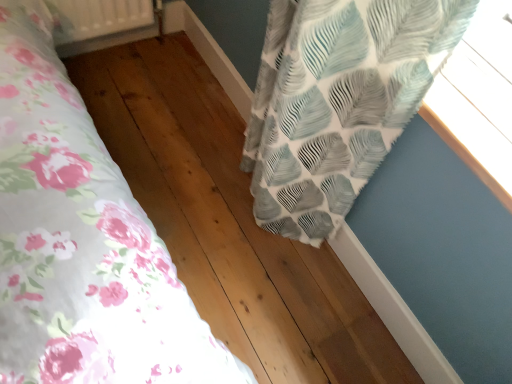
Question: Is white plastic radiator at upper left thinner than textured fabric curtain at upper right?

Choices:
 (A) no
 (B) yes

Answer: (B)

Question: Could textured fabric curtain at upper right be considered to be inside white plastic radiator at upper left?

Choices:
 (A) no
 (B) yes

Answer: (A)

Question: Does white plastic radiator at upper left have a larger size compared to textured fabric curtain at upper right?

Choices:
 (A) no
 (B) yes

Answer: (A)

Question: Can you confirm if white plastic radiator at upper left is wider than textured fabric curtain at upper right?

Choices:
 (A) yes
 (B) no

Answer: (B)

Question: Considering the relative sizes of white plastic radiator at upper left and textured fabric curtain at upper right in the image provided, is white plastic radiator at upper left shorter than textured fabric curtain at upper right?

Choices:
 (A) yes
 (B) no

Answer: (B)

Question: Choose the correct answer: Is white plastic radiator at upper left inside textured fabric curtain at upper right or outside it?

Choices:
 (A) outside
 (B) inside

Answer: (A)

Question: From the image's perspective, is white plastic radiator at upper left located above or below textured fabric curtain at upper right?

Choices:
 (A) above
 (B) below

Answer: (A)

Question: In terms of height, does white plastic radiator at upper left look taller or shorter compared to textured fabric curtain at upper right?

Choices:
 (A) tall
 (B) short

Answer: (A)

Question: Is point (97, 3) positioned closer to the camera than point (432, 96)?

Choices:
 (A) closer
 (B) farther

Answer: (B)

Question: Would you say textured fabric curtain at upper right is to the left or to the right of textured white and blue leaf-patterned curtain at upper right in the picture?

Choices:
 (A) right
 (B) left

Answer: (A)

Question: In the image, is textured fabric curtain at upper right positioned in front of or behind textured white and blue leaf-patterned curtain at upper right?

Choices:
 (A) behind
 (B) front

Answer: (B)

Question: Based on their sizes in the image, would you say textured fabric curtain at upper right is bigger or smaller than textured white and blue leaf-patterned curtain at upper right?

Choices:
 (A) small
 (B) big

Answer: (B)

Question: From the image's perspective, is textured fabric curtain at upper right located above or below textured white and blue leaf-patterned curtain at upper right?

Choices:
 (A) below
 (B) above

Answer: (B)

Question: Considering the positions of point (287, 62) and point (150, 13), is point (287, 62) closer or farther from the camera than point (150, 13)?

Choices:
 (A) farther
 (B) closer

Answer: (B)

Question: From a real-world perspective, is textured white and blue leaf-patterned curtain at upper right above or below white plastic radiator at upper left?

Choices:
 (A) below
 (B) above

Answer: (B)